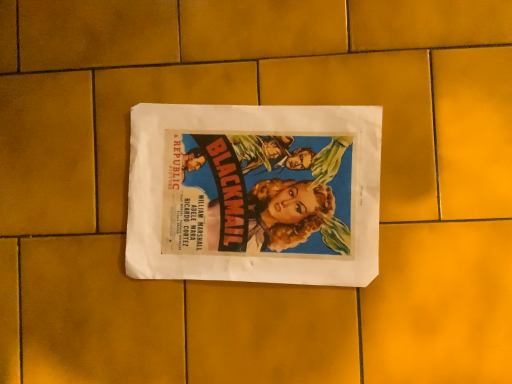
Find the location of `matte paper poster at center`. matte paper poster at center is located at coordinates (254, 193).

What do you see at coordinates (254, 193) in the screenshot?
I see `matte paper poster at center` at bounding box center [254, 193].

Identify the location of matte paper poster at center. Image resolution: width=512 pixels, height=384 pixels. (254, 193).